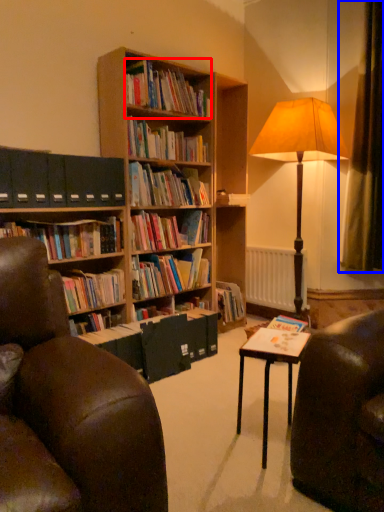
Question: Which object appears farthest to the camera in this image, book (highlighted by a red box) or curtain (highlighted by a blue box)?

Choices:
 (A) book
 (B) curtain

Answer: (B)